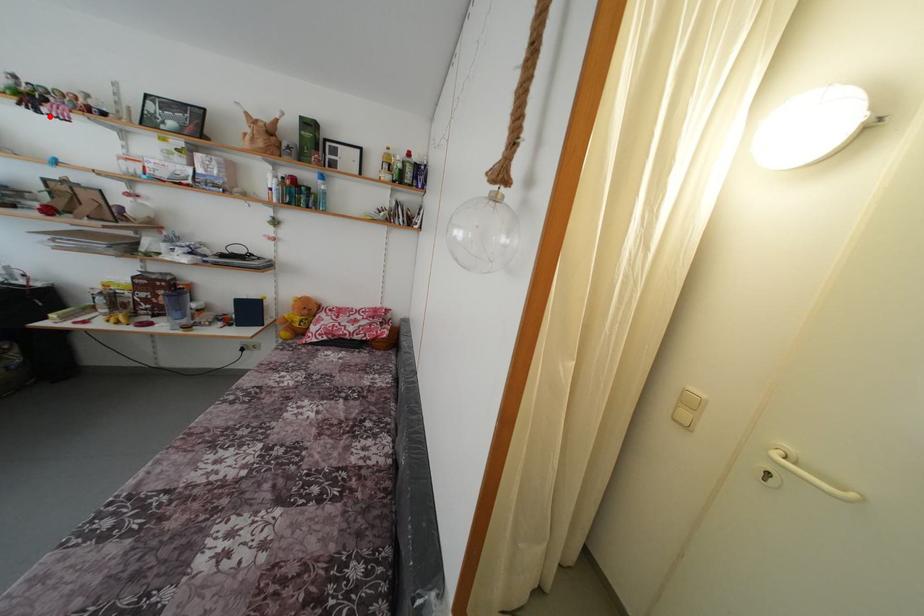
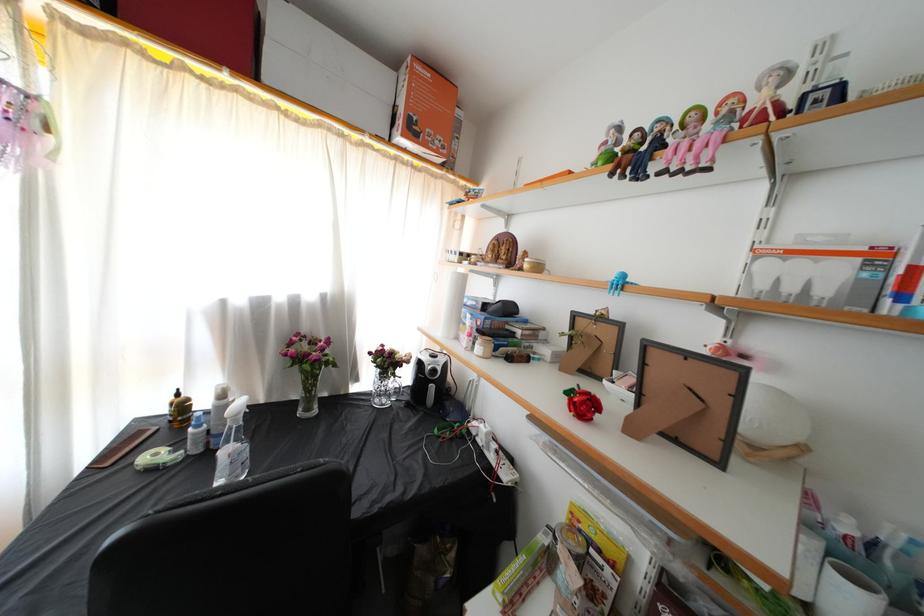
In the second image, find the point that corresponds to the highlighted location in the first image.

(659, 172)